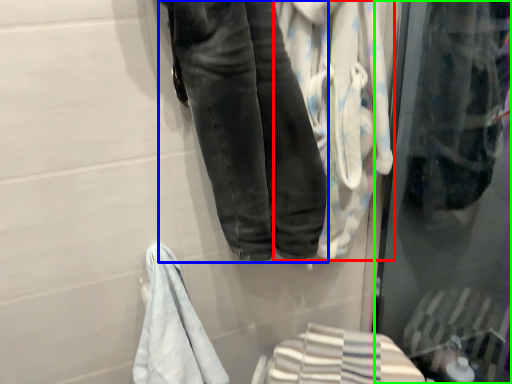
Question: Based on their relative distances, which object is nearer to bath towel (highlighted by a red box)? Choose from trousers (highlighted by a blue box) and glass door (highlighted by a green box).

Choices:
 (A) trousers
 (B) glass door

Answer: (A)